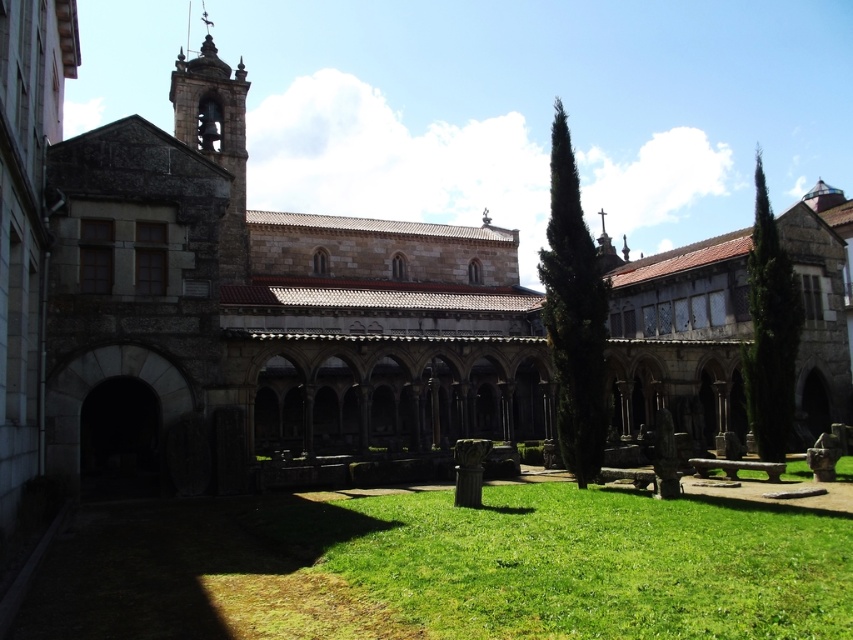
Question: Observing the image, what is the correct spatial positioning of green grass at lower center in reference to stone bell tower at upper left?

Choices:
 (A) below
 (B) above

Answer: (A)

Question: Among these objects, which one is nearest to the camera?

Choices:
 (A) stone bell tower at upper left
 (B) green grass at lower center

Answer: (B)

Question: Can you confirm if green grass at lower center is positioned above stone bell tower at upper left?

Choices:
 (A) no
 (B) yes

Answer: (A)

Question: Is green grass at lower center thinner than stone bell tower at upper left?

Choices:
 (A) no
 (B) yes

Answer: (A)